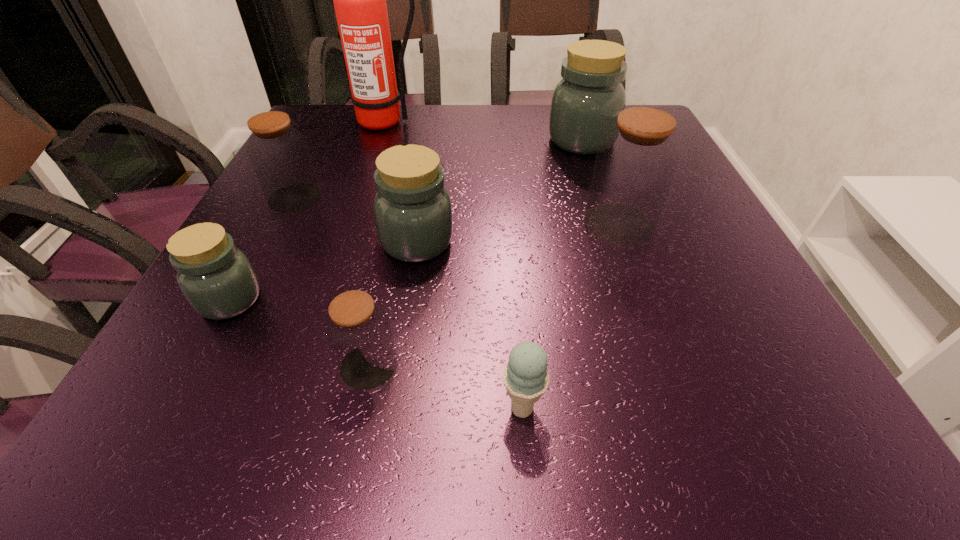
Where is `vacant area in the image that satisfies the following two spatial constraints: 1. on the back side of the biggest brown jar; 2. on the left side of the ice cream`? The height and width of the screenshot is (540, 960). vacant area in the image that satisfies the following two spatial constraints: 1. on the back side of the biggest brown jar; 2. on the left side of the ice cream is located at coordinates (509, 224).

Find the location of a particular element. This screenshot has height=540, width=960. free spot that satisfies the following two spatial constraints: 1. on the back side of the farthest green jar; 2. on the right side of the third nearest object is located at coordinates (316, 140).

In order to click on blank space that satisfies the following two spatial constraints: 1. on the back side of the second brown jar from left to right; 2. on the left side of the second biggest green jar in this screenshot , I will do `click(396, 241)`.